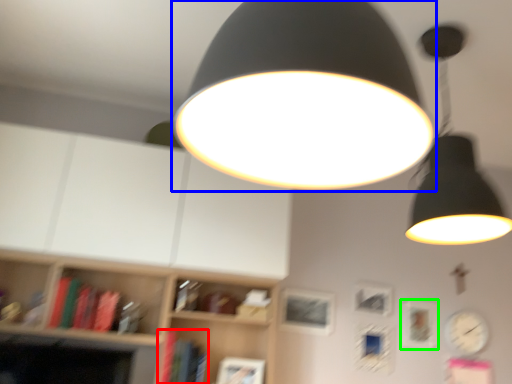
Question: Based on their relative distances, which object is farther from book (highlighted by a red box)? Choose from lamp (highlighted by a blue box) and picture frame (highlighted by a green box).

Choices:
 (A) lamp
 (B) picture frame

Answer: (A)